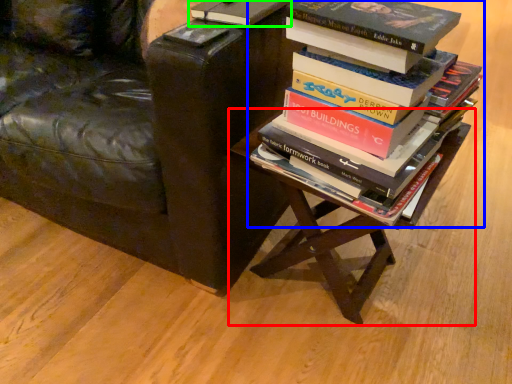
Question: Considering the real-world distances, which object is farthest from table (highlighted by a red box)? book (highlighted by a blue box) or book (highlighted by a green box)?

Choices:
 (A) book
 (B) book

Answer: (B)